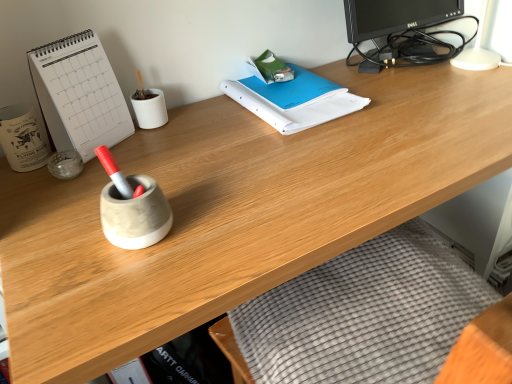
Find the location of `free location to the right of white ceramic mug at left, which appears as the second stationery when viewed from the right`. free location to the right of white ceramic mug at left, which appears as the second stationery when viewed from the right is located at coordinates (123, 163).